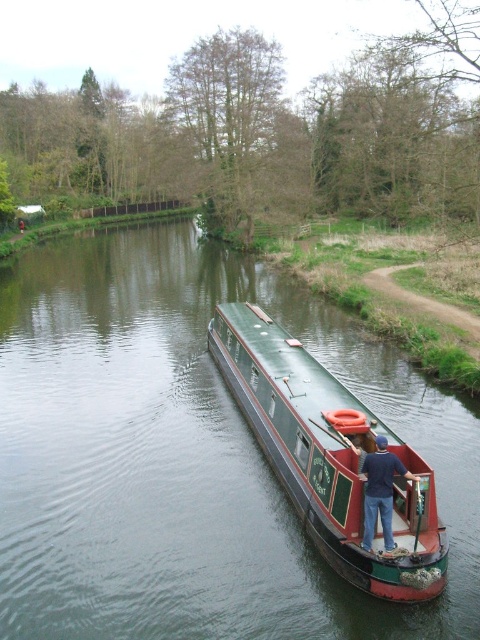
You are a tourist standing at the edge of the canal and want to take a photo of the boat. The boat is located at point (188, 454). What is the color of the boat?

The boat at point (188, 454) is described as green polished wood boat at center, so the color is green.

You are standing at the point with coordinates (332, 458) in the canal scene. What object are you directly at?

The point at coordinates (332, 458) is where the green painted wood boat at center is located.

You are a photographer positioned on the canal bank. You want to capture a photo of the green polished wood boat at center and the dark blue shirt at center. Which object should you focus on first if you want to ensure both are in sharp focus?

The green polished wood boat at center is above the dark blue shirt at center, so you should focus on the boat first to ensure both are in sharp focus since it is closer to the camera.